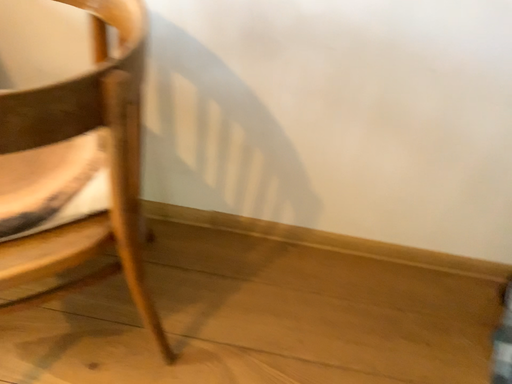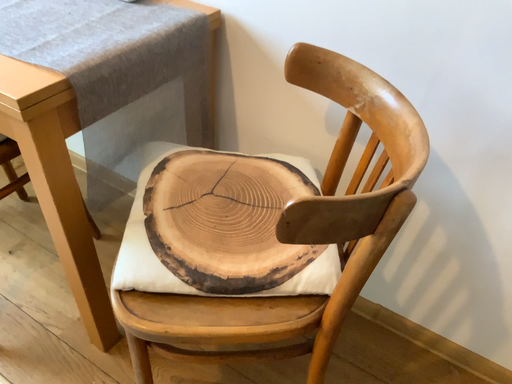
Question: How did the camera likely rotate when shooting the video?

Choices:
 (A) rotated right
 (B) rotated left

Answer: (B)